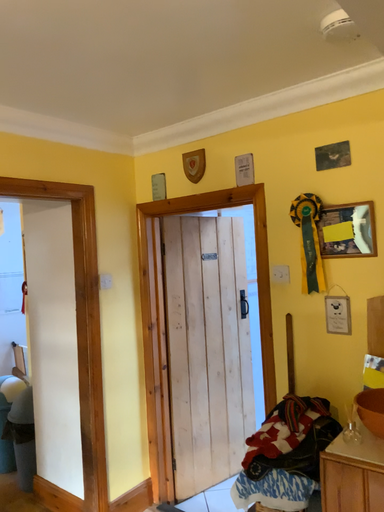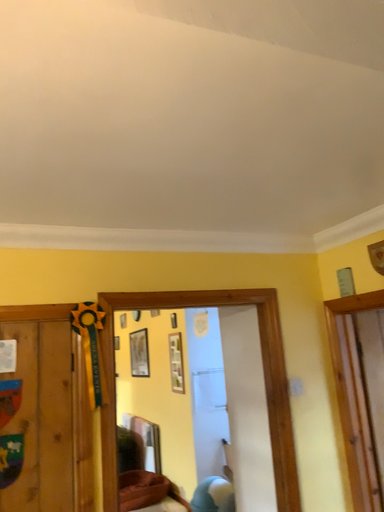
Question: Which way did the camera rotate in the video?

Choices:
 (A) rotated downward
 (B) rotated upward

Answer: (B)